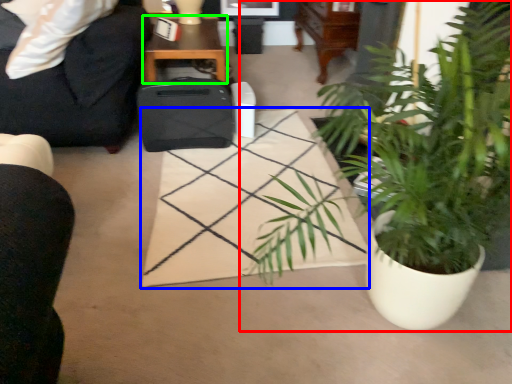
Question: Which is nearer to the houseplant (highlighted by a red box)? plain (highlighted by a blue box) or table (highlighted by a green box).

Choices:
 (A) plain
 (B) table

Answer: (A)